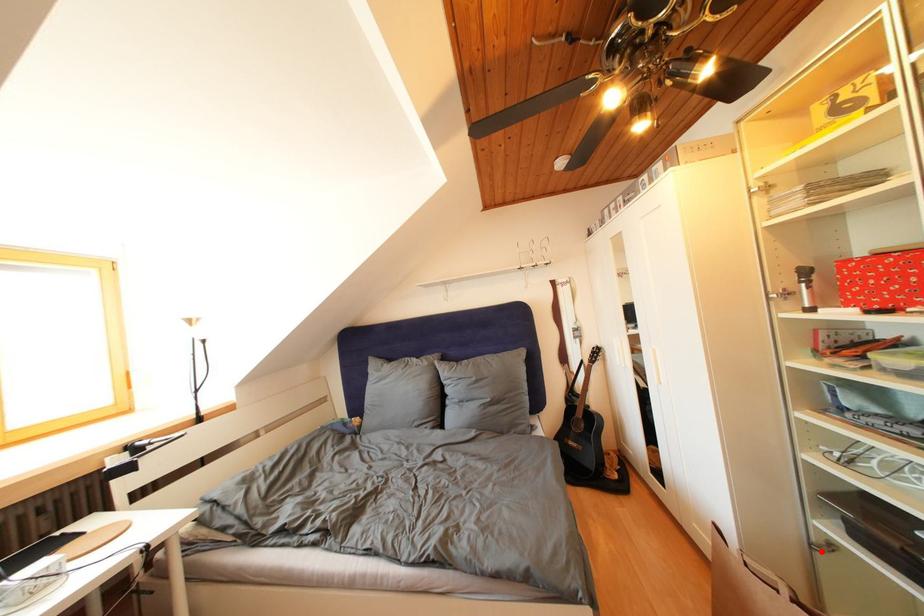
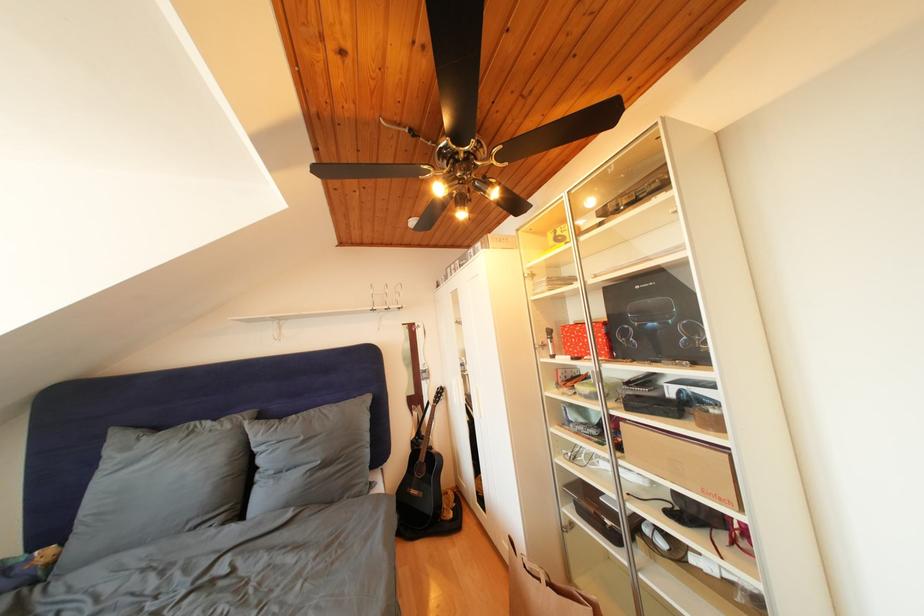
Where in the second image is the point corresponding to the highlighted location from the first image?

(572, 533)